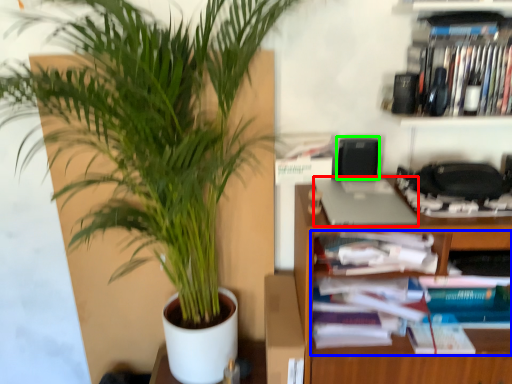
Question: Based on their relative distances, which object is nearer to laptop (highlighted by a red box)? Choose from book (highlighted by a blue box) and speaker (highlighted by a green box).

Choices:
 (A) book
 (B) speaker

Answer: (B)